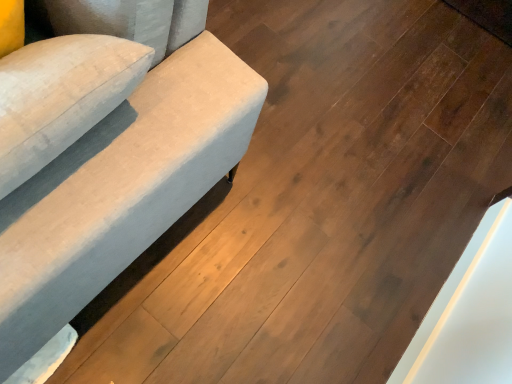
The width and height of the screenshot is (512, 384). What do you see at coordinates (106, 153) in the screenshot?
I see `velvet beige sofa at left` at bounding box center [106, 153].

Where is `velvet beige sofa at left`? The height and width of the screenshot is (384, 512). velvet beige sofa at left is located at coordinates (106, 153).

Identify the location of velvet beige sofa at left. (106, 153).